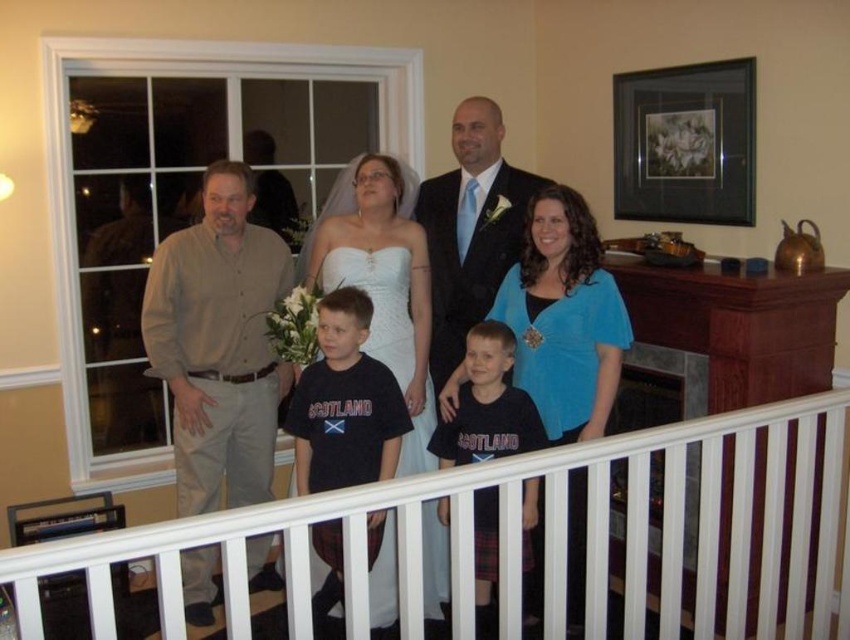
How distant is dark blue t-shirt at center from shiny black suit at center?

The distance of dark blue t-shirt at center from shiny black suit at center is 28.67 inches.

In order to click on dark blue t-shirt at center in this screenshot , I will do `click(344, 403)`.

In order to click on dark blue t-shirt at center in this screenshot , I will do `click(344, 403)`.

Which is behind, point (536, 611) or point (503, 358)?

Point (536, 611)

In the scene shown: Which is more to the right, blue velvet blouse at center or black cotton shirt at center?

Positioned to the right is blue velvet blouse at center.

Which is in front, point (547, 378) or point (465, 461)?

Point (547, 378) is in front.

Locate an element on the screen. blue velvet blouse at center is located at coordinates (564, 317).

Can you confirm if beige cotton shirt at left is positioned below shiny black suit at center?

Correct, beige cotton shirt at left is located below shiny black suit at center.

Does beige cotton shirt at left appear on the right side of shiny black suit at center?

Incorrect, beige cotton shirt at left is not on the right side of shiny black suit at center.

Does point (212, 452) lie in front of point (491, 301)?

That is True.

The image size is (850, 640). In order to click on beige cotton shirt at left in this screenshot , I will do `click(219, 342)`.